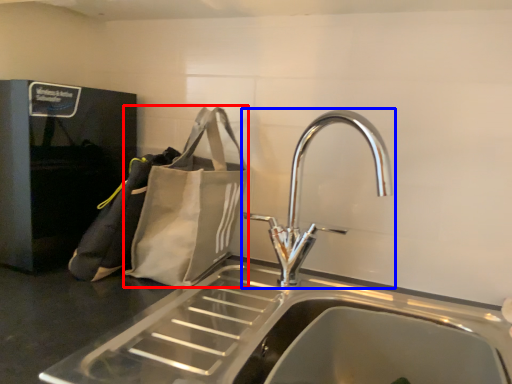
Question: Which point is closer to the camera, pouch (highlighted by a red box) or tap (highlighted by a blue box)?

Choices:
 (A) pouch
 (B) tap

Answer: (B)